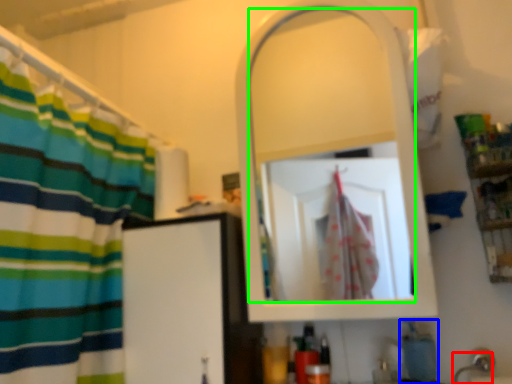
Question: Which object is positioned closest to faucet (highlighted by a red box)? Select from soap (highlighted by a blue box) and mirror (highlighted by a green box).

Choices:
 (A) soap
 (B) mirror

Answer: (A)